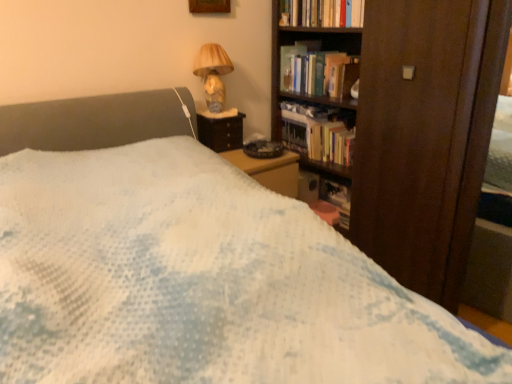
Question: Which direction should I rotate to look at hardcover books at upper center, acting as the 1th book starting from the top, — up or down?

Choices:
 (A) down
 (B) up

Answer: (B)

Question: Can you confirm if hardcover books at center, which appears as the 3th book when ordered from the bottom, is positioned to the left of matte glass table lamp at upper right?

Choices:
 (A) no
 (B) yes

Answer: (A)

Question: Is hardcover books at center, the 2th book positioned from the top, not within matte glass table lamp at upper right?

Choices:
 (A) yes
 (B) no

Answer: (A)

Question: Is hardcover books at center, which appears as the 3th book when ordered from the bottom, with matte glass table lamp at upper right?

Choices:
 (A) no
 (B) yes

Answer: (A)

Question: From a real-world perspective, is hardcover books at center, which appears as the 3th book when ordered from the bottom, physically below matte glass table lamp at upper right?

Choices:
 (A) yes
 (B) no

Answer: (A)

Question: Is hardcover books at center, which appears as the 3th book when ordered from the bottom, aimed at matte glass table lamp at upper right?

Choices:
 (A) no
 (B) yes

Answer: (B)

Question: Is hardcover books at center, which appears as the 3th book when ordered from the bottom, far away from matte glass table lamp at upper right?

Choices:
 (A) no
 (B) yes

Answer: (A)

Question: Considering the relative sizes of hardcover book at center, the 2th book positioned from the bottom, and hardcover books at center, the 2th book positioned from the top, in the image provided, is hardcover book at center, the 2th book positioned from the bottom, thinner than hardcover books at center, the 2th book positioned from the top,?

Choices:
 (A) no
 (B) yes

Answer: (A)

Question: From a real-world perspective, is hardcover book at center, positioned as the 3th book in top-to-bottom order, below hardcover books at center, the 2th book positioned from the top?

Choices:
 (A) yes
 (B) no

Answer: (A)

Question: From the image's perspective, is hardcover book at center, positioned as the 3th book in top-to-bottom order, on hardcover books at center, the 2th book positioned from the top?

Choices:
 (A) yes
 (B) no

Answer: (B)

Question: Can you confirm if hardcover book at center, the 2th book positioned from the bottom, is wider than hardcover books at center, which appears as the 3th book when ordered from the bottom?

Choices:
 (A) no
 (B) yes

Answer: (B)

Question: Can you confirm if hardcover book at center, positioned as the 3th book in top-to-bottom order, is positioned to the left of hardcover books at center, the 2th book positioned from the top?

Choices:
 (A) no
 (B) yes

Answer: (B)

Question: Is hardcover book at center, the 2th book positioned from the bottom, positioned before hardcover books at center, the 2th book positioned from the top?

Choices:
 (A) yes
 (B) no

Answer: (B)

Question: Is hardcover book at upper right aimed at hardcover book at center, positioned as the 3th book in top-to-bottom order?

Choices:
 (A) no
 (B) yes

Answer: (A)